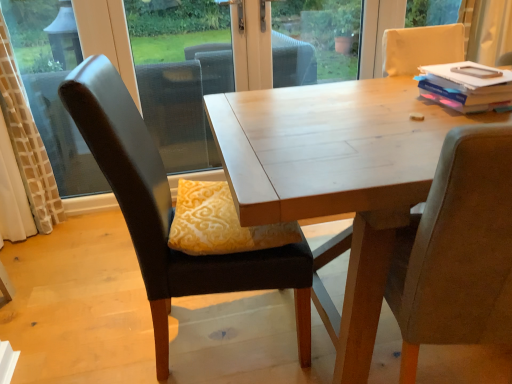
Question: Considering the positions of matte gray chair at right, which is the 1th chair in right-to-left order, and hardcover book at upper right in the image, is matte gray chair at right, which is the 1th chair in right-to-left order, wider or thinner than hardcover book at upper right?

Choices:
 (A) wide
 (B) thin

Answer: (A)

Question: From the image's perspective, is matte gray chair at right, which is the second chair in left-to-right order, located above or below hardcover book at upper right?

Choices:
 (A) below
 (B) above

Answer: (A)

Question: Which object is positioned closest to the matte black chair at left, the first chair from the left?

Choices:
 (A) hardcover book at upper right
 (B) matte gray chair at right, which is the second chair in left-to-right order
 (C) yellow velvet pillow at center

Answer: (C)

Question: Estimate the real-world distances between objects in this image. Which object is closer to the yellow velvet pillow at center?

Choices:
 (A) matte gray chair at right, which is the second chair in left-to-right order
 (B) hardcover book at upper right
 (C) matte black chair at left, the first chair from the left

Answer: (C)